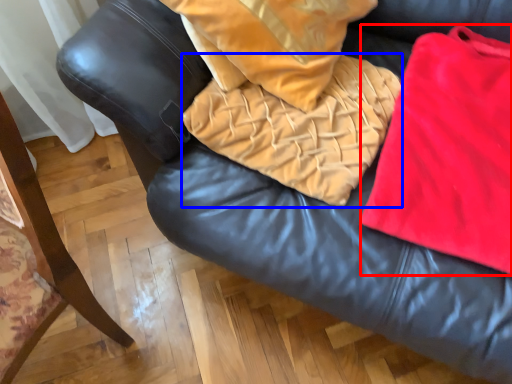
Question: Which object is closer to the camera taking this photo, cloth (highlighted by a red box) or blanket (highlighted by a blue box)?

Choices:
 (A) cloth
 (B) blanket

Answer: (A)